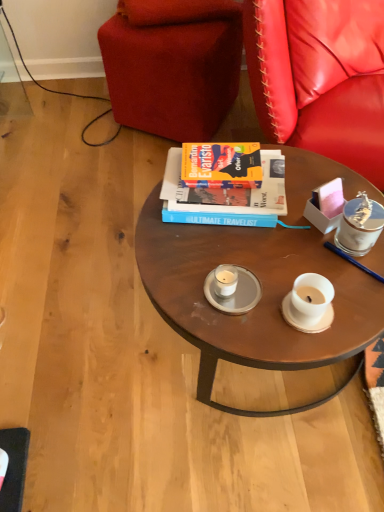
Identify the location of free space in front of hardcover book at center. Image resolution: width=384 pixels, height=512 pixels. (235, 264).